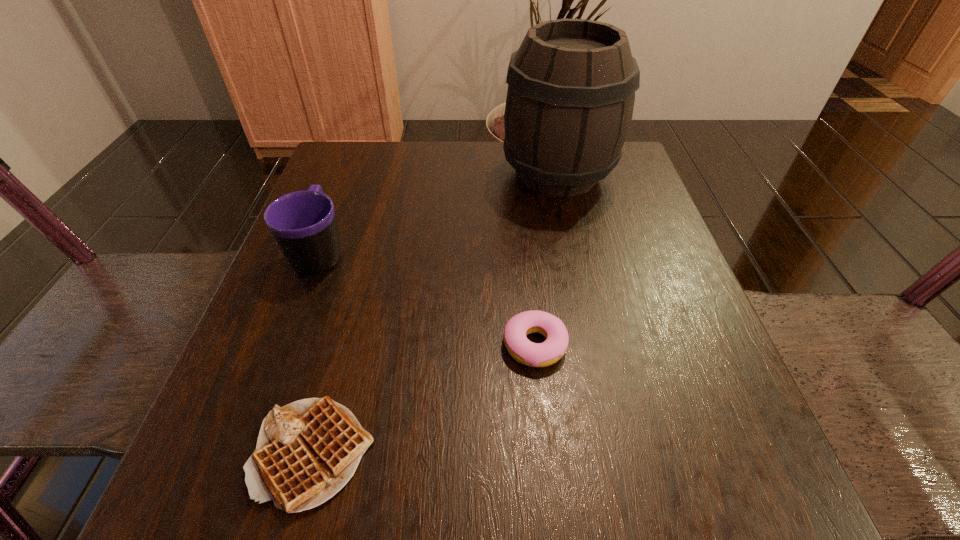
Where is `vacant area in the image that satisfies the following two spatial constraints: 1. on the back side of the waffle; 2. on the left side of the wine bucket`? This screenshot has width=960, height=540. vacant area in the image that satisfies the following two spatial constraints: 1. on the back side of the waffle; 2. on the left side of the wine bucket is located at coordinates (387, 174).